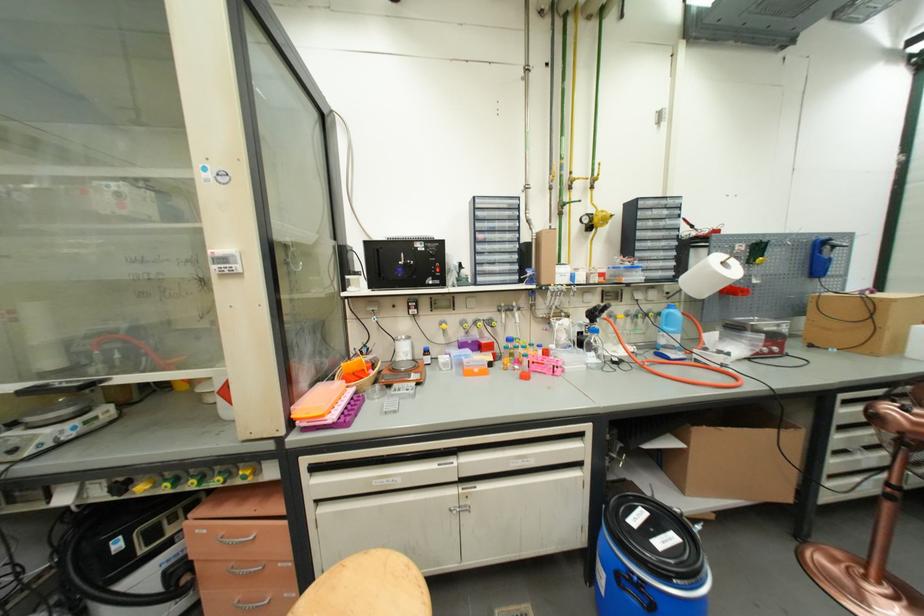
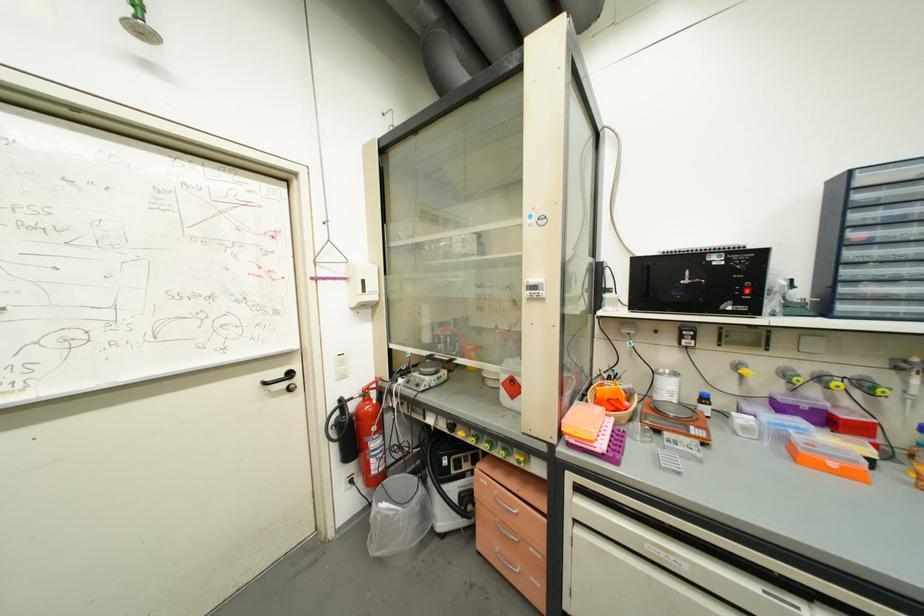
Locate, in the second image, the point that corresponds to (x=225, y=180) in the first image.

(544, 224)